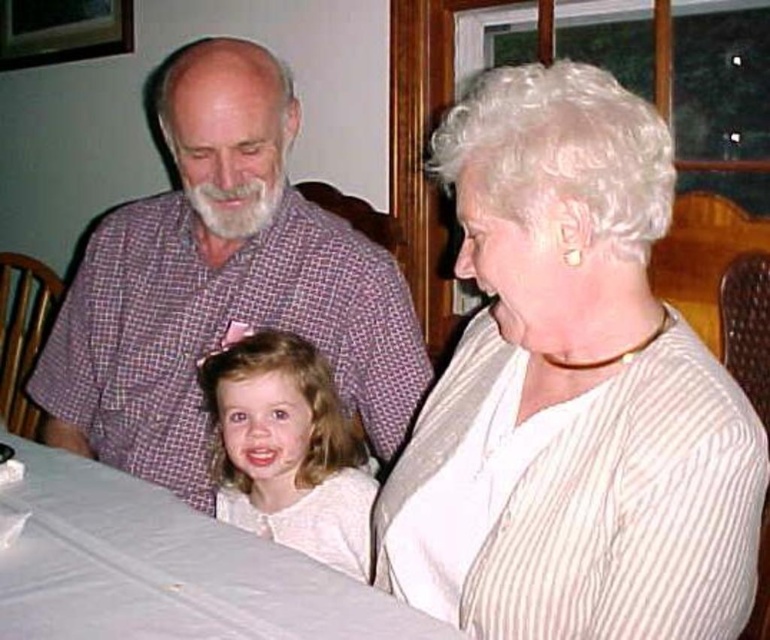
You are standing in the dining room and want to place a small vase between the two points labeled point (387, 301) and point (317, 376). Which point should the vase be closer to if you want it to appear closer to you?

The vase should be placed closer to point (387, 301) because it is further to the camera than point (317, 376), making it appear closer to you.

You are a guest at this family gathering and need to sit down. There are two items in view that could be seating options. Which one is more suitable for sitting? Please choose between the white plastic table at lower left and the blonde hair at center.

The white plastic table at lower left is larger in size than the blonde hair at center, so the white plastic table at lower left is more suitable for sitting as it is bigger and likely a proper seating option.

You are standing in the dining room and see the purple checkered shirt at upper left and the blonde hair at center. Which object is positioned more to the left?

The purple checkered shirt at upper left is positioned more to the left than the blonde hair at center.